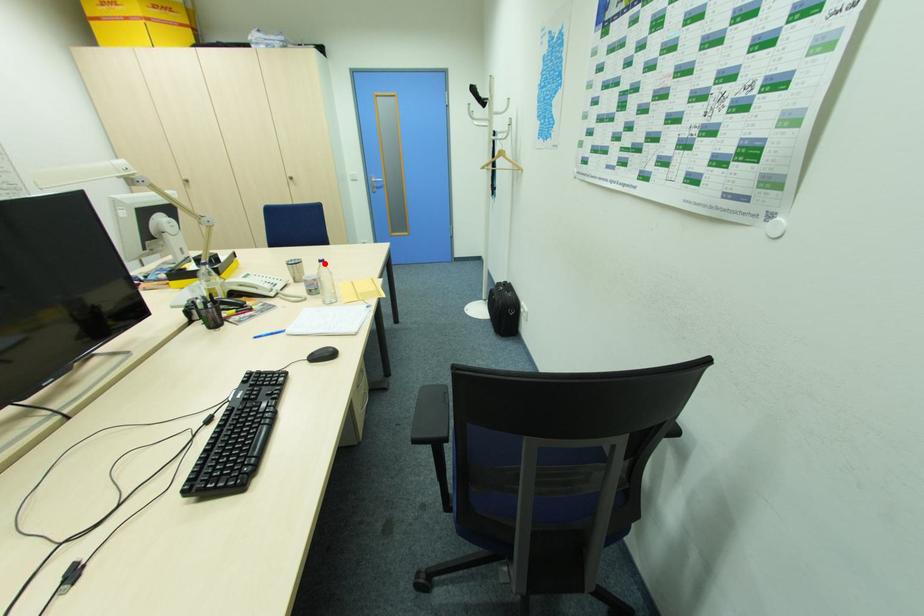
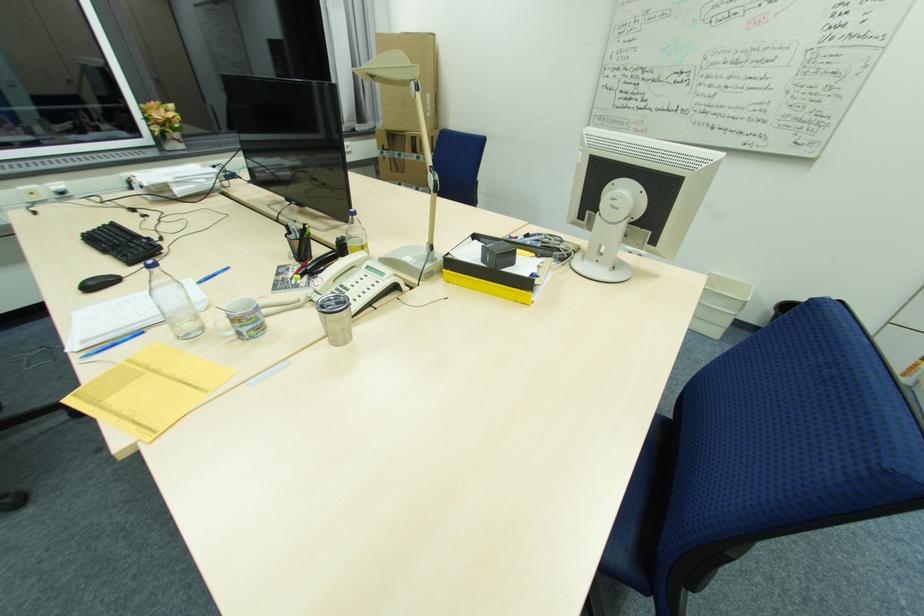
The point at the highlighted location is marked in the first image. Where is the corresponding point in the second image?

(157, 270)